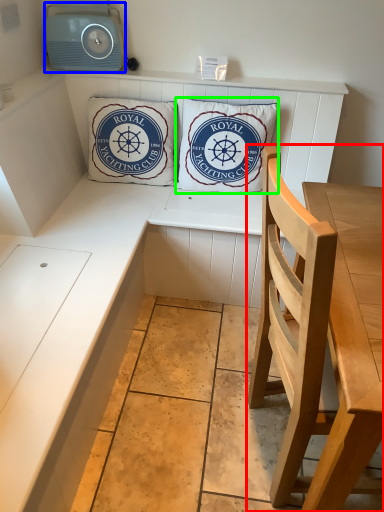
Question: Considering the real-world distances, which object is closest to chair (highlighted by a red box)? stereo (highlighted by a blue box) or pillow (highlighted by a green box).

Choices:
 (A) stereo
 (B) pillow

Answer: (B)